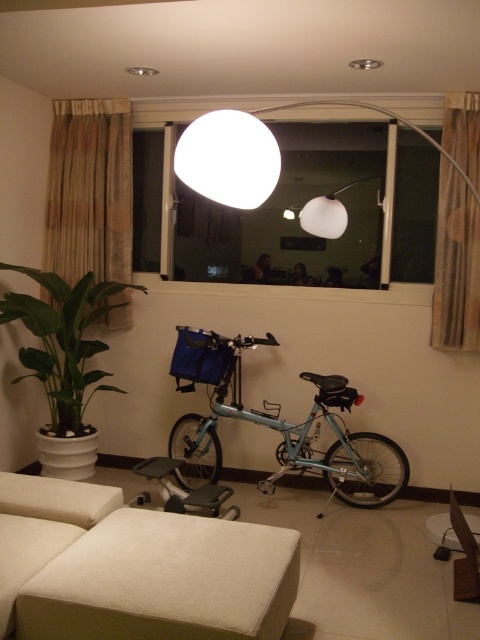
Describe the element at coordinates (134, 568) in the screenshot. I see `beige fabric ottoman at lower center` at that location.

Between point (278, 532) and point (478, 538), which one is positioned in front?

Point (278, 532) is more forward.

What do you see at coordinates (134, 568) in the screenshot?
I see `beige fabric ottoman at lower center` at bounding box center [134, 568].

At what (x,y) coordinates should I click in order to perform the action: click on beige fabric ottoman at lower center. Please return your answer as a coordinate pair (x, y). The image size is (480, 640). Looking at the image, I should click on (134, 568).

Is transparent glass window at center positioned behind light blue metallic bicycle at center?

That is True.

Between point (339, 152) and point (317, 381), which one is positioned behind?

The point (339, 152) is behind.

I want to click on transparent glass window at center, so click(x=292, y=214).

Can you confirm if beige fabric ottoman at lower center is taller than green glossy plant at left?

No, beige fabric ottoman at lower center is not taller than green glossy plant at left.

Is point (156, 544) positioned after point (33, 356)?

No, it is not.

You are a GUI agent. You are given a task and a screenshot of the screen. Output one action in this format:
    pyautogui.click(x=<x>, y=<y>)
    Task: Click on the beige fabric ottoman at lower center
    This screenshot has height=640, width=480.
    Given the screenshot: What is the action you would take?
    pos(134,568)